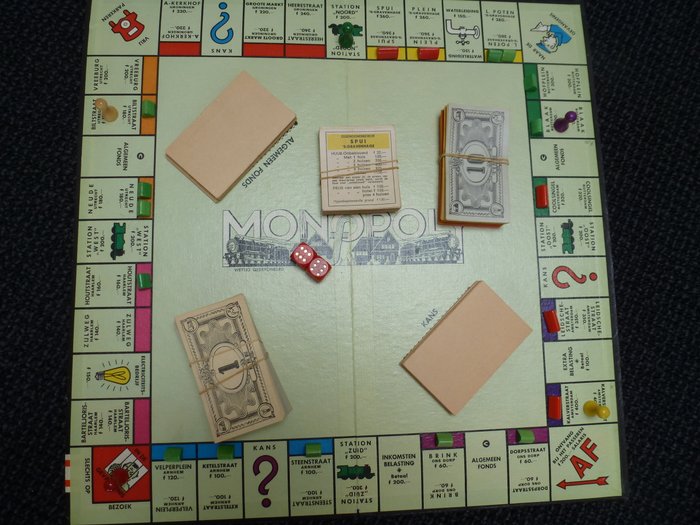
Where is `corner spaces`? Image resolution: width=700 pixels, height=525 pixels. corner spaces is located at coordinates (106, 16), (570, 31), (589, 460), (99, 492).